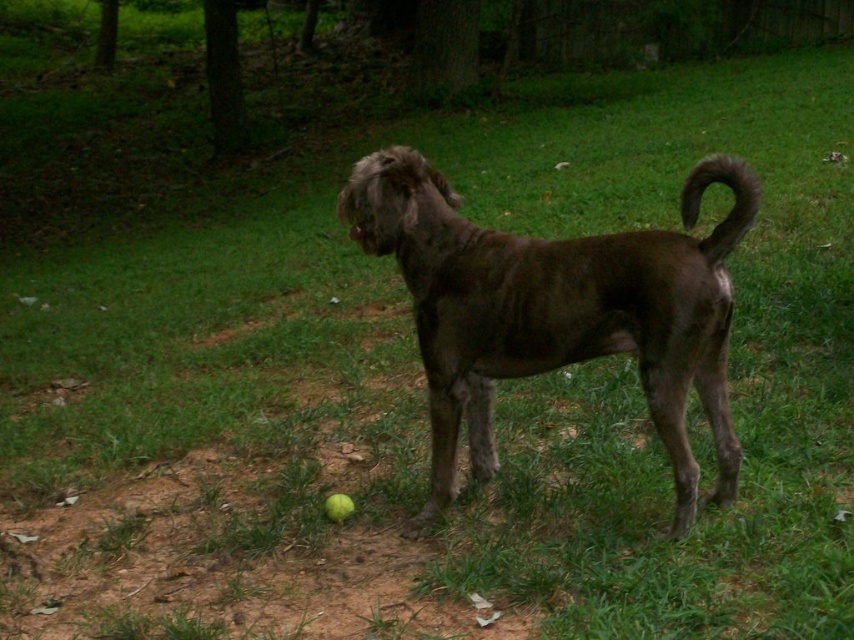
Question: Is shiny brown fur at center wider than brown furry tail at right?

Choices:
 (A) no
 (B) yes

Answer: (B)

Question: Which object appears closest to the camera in this image?

Choices:
 (A) brown furry tail at right
 (B) shiny brown fur at center

Answer: (B)

Question: Which point is farther to the camera?

Choices:
 (A) shiny brown fur at center
 (B) brown furry tail at right

Answer: (B)

Question: Is shiny brown fur at center positioned at the back of brown furry tail at right?

Choices:
 (A) no
 (B) yes

Answer: (A)

Question: Which point appears farthest from the camera in this image?

Choices:
 (A) (705, 176)
 (B) (519, 301)

Answer: (B)

Question: Is the position of shiny brown fur at center less distant than that of brown furry tail at right?

Choices:
 (A) no
 (B) yes

Answer: (B)